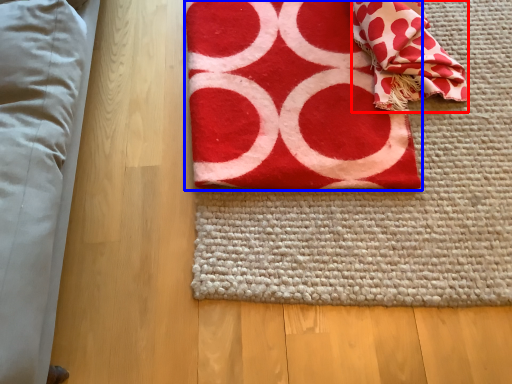
Question: Which of the following is the closest to the observer, blanket (highlighted by a red box) or towel (highlighted by a blue box)?

Choices:
 (A) blanket
 (B) towel

Answer: (B)